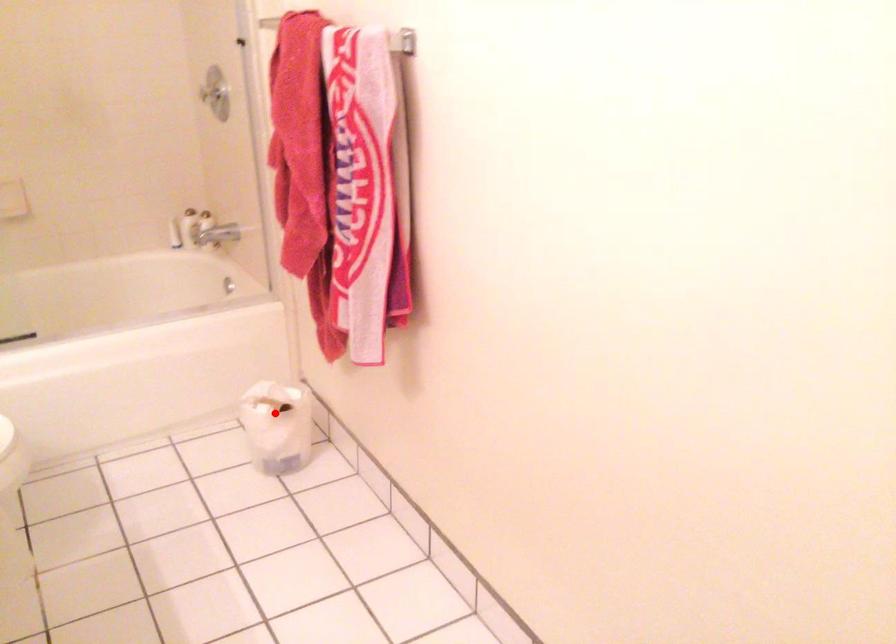
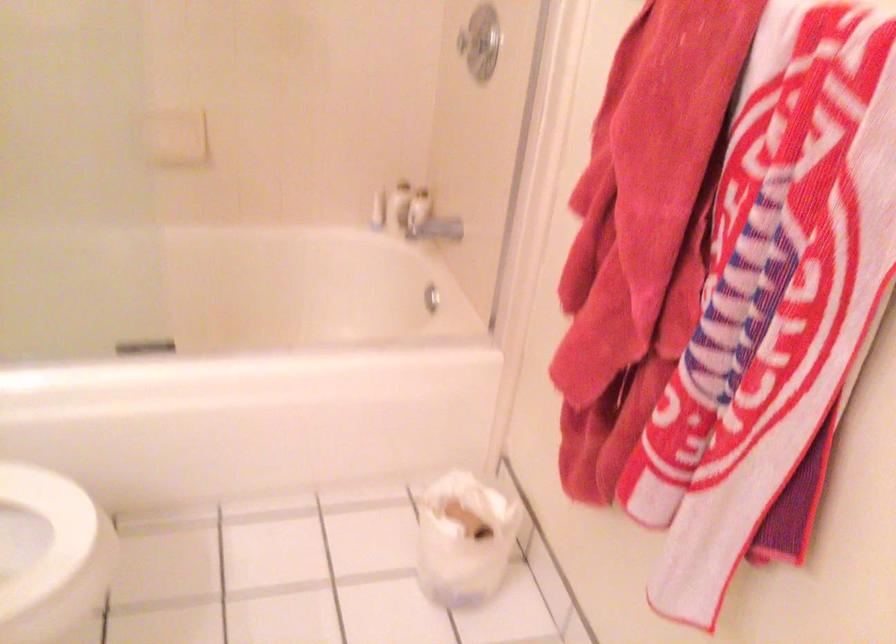
Question: I am providing you with two images of the same scene from different viewpoints. Given a red point in image1, look at the same physical point in image2. Is it:

Choices:
 (A) Closer to the viewpoint
 (B) Farther from the viewpoint

Answer: (A)